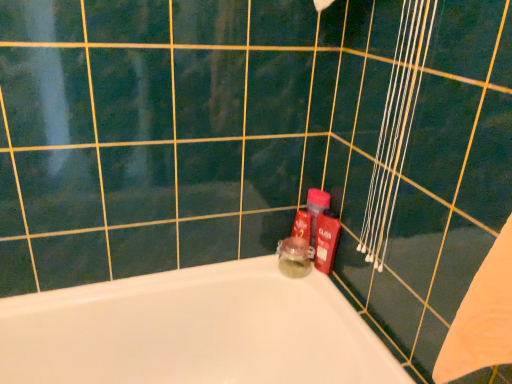
Question: Considering the relative positions of white glossy bathtub at lower left and translucent glass jar at center, which is the 2th toiletry from right to left, in the image provided, is white glossy bathtub at lower left to the left or to the right of translucent glass jar at center, which is the 2th toiletry from right to left,?

Choices:
 (A) right
 (B) left

Answer: (B)

Question: Is white glossy bathtub at lower left taller or shorter than translucent glass jar at center, acting as the 1th toiletry starting from the left?

Choices:
 (A) tall
 (B) short

Answer: (A)

Question: Which of these objects is positioned farthest from the white glossy bathtub at lower left?

Choices:
 (A) translucent glass jar at center, acting as the 1th toiletry starting from the left
 (B) shiny plastic bottle at right, which is the first toiletry in right-to-left order

Answer: (B)

Question: Which object is positioned farthest from the white glossy bathtub at lower left?

Choices:
 (A) shiny plastic bottle at right, which is the first toiletry in right-to-left order
 (B) translucent glass jar at center, which is the 2th toiletry from right to left

Answer: (A)